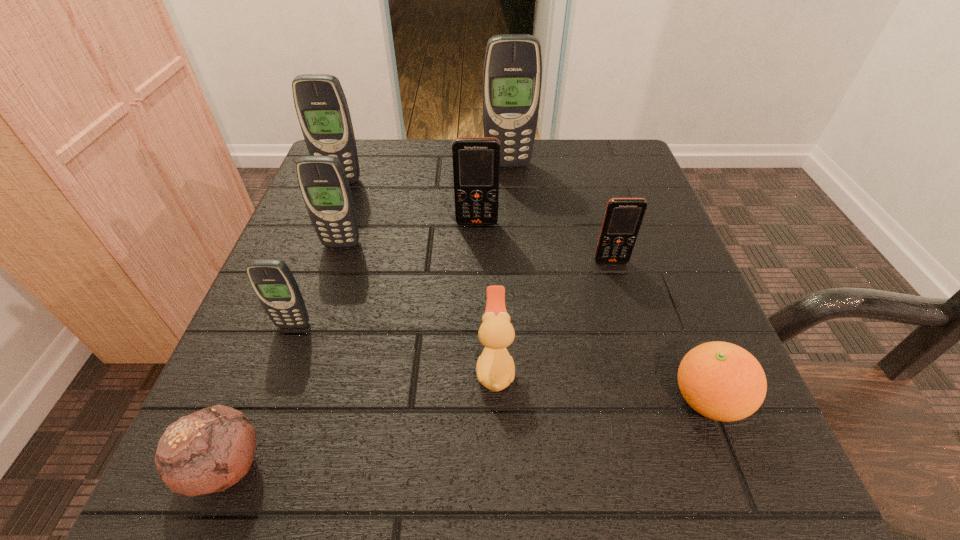
At what (x,y) coordinates should I click in order to perform the action: click on orange at the right edge. Please return your answer as a coordinate pair (x, y). The width and height of the screenshot is (960, 540). Looking at the image, I should click on (722, 381).

Find the location of a particular element. Image resolution: width=960 pixels, height=540 pixels. object that is at the far left corner is located at coordinates (321, 106).

Where is `object located in the near left corner section of the desktop`? object located in the near left corner section of the desktop is located at coordinates (208, 451).

The height and width of the screenshot is (540, 960). I want to click on object located at the near right corner, so click(x=722, y=381).

The width and height of the screenshot is (960, 540). In order to click on vacant space at the far edge of the desktop in this screenshot , I will do `click(424, 166)`.

Where is `vacant point at the left edge`? The width and height of the screenshot is (960, 540). vacant point at the left edge is located at coordinates (299, 268).

Where is `vacant space at the right edge`? This screenshot has width=960, height=540. vacant space at the right edge is located at coordinates (646, 223).

At what (x,y) coordinates should I click in order to perform the action: click on vacant region at the far left corner of the desktop. Please return your answer as a coordinate pair (x, y). Looking at the image, I should click on (365, 149).

The height and width of the screenshot is (540, 960). Find the location of `vacant point at the far right corner`. vacant point at the far right corner is located at coordinates (594, 188).

Where is `empty space that is in between the nearest cellular telephone and the tallest object`? empty space that is in between the nearest cellular telephone and the tallest object is located at coordinates (400, 245).